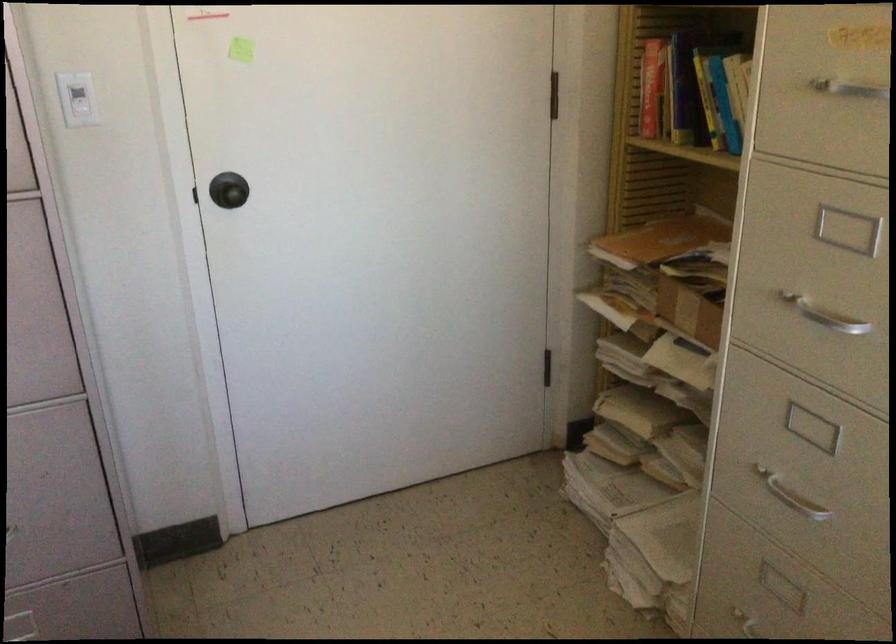
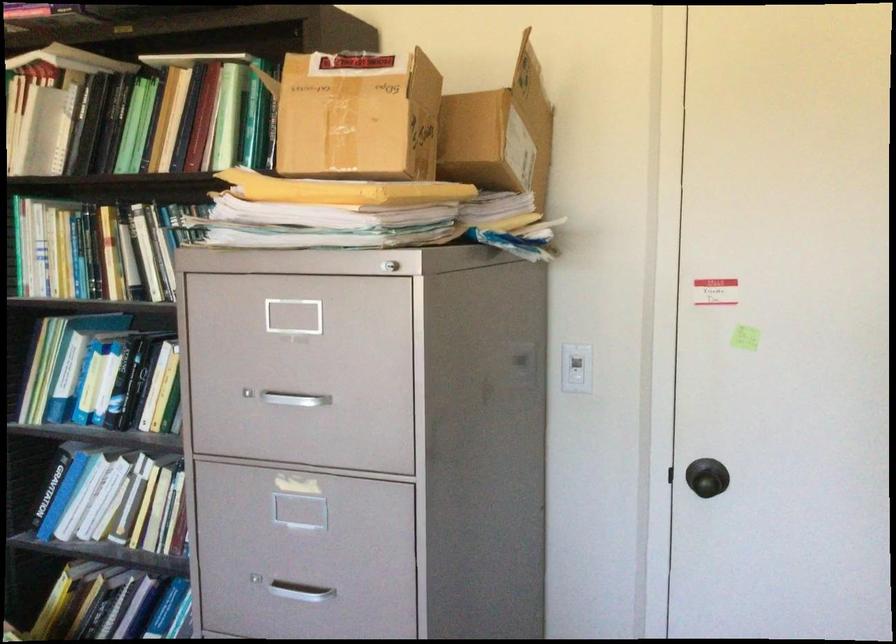
The point at (225, 196) is marked in the first image. Where is the corresponding point in the second image?

(707, 482)